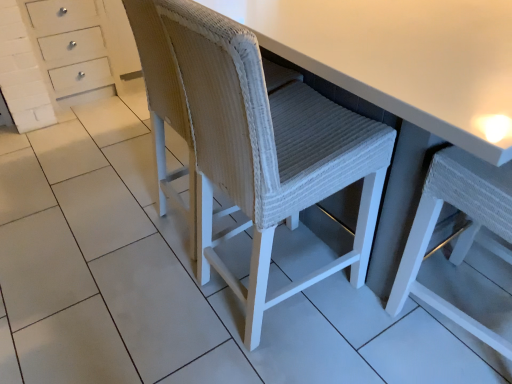
Measure the distance between point (x=506, y=207) and camera.

The depth of point (x=506, y=207) is 37.40 inches.

The image size is (512, 384). Identify the location of white woven chair at center, the 2th chair viewed from the right. (255, 140).

Where is `white woven chair at center, which ranks as the 1th chair in right-to-left order`? white woven chair at center, which ranks as the 1th chair in right-to-left order is located at coordinates (461, 233).

Does white woven stool at center appear on the right side of white woven swivel chair at center?

Correct, you'll find white woven stool at center to the right of white woven swivel chair at center.

Is white woven stool at center inside or outside of white woven swivel chair at center?

white woven stool at center is outside white woven swivel chair at center.

Which object is closer to the camera taking this photo, white woven chair at center, which is the 2th chair from left to right, or white woven chair at center, which appears as the first chair when viewed from the left?

white woven chair at center, which is the 2th chair from left to right, is closer to the camera.

Considering the sizes of white woven chair at center, which ranks as the 1th chair in right-to-left order, and white woven chair at center, which appears as the first chair when viewed from the left, in the image, is white woven chair at center, which ranks as the 1th chair in right-to-left order, wider or thinner than white woven chair at center, which appears as the first chair when viewed from the left,?

Clearly, white woven chair at center, which ranks as the 1th chair in right-to-left order, has less width compared to white woven chair at center, which appears as the first chair when viewed from the left.

From a real-world perspective, who is located lower, white woven chair at center, which is the 2th chair from left to right, or white woven chair at center, the 2th chair viewed from the right?

white woven chair at center, which is the 2th chair from left to right, is physically lower.

Is white woven chair at center, the 2th chair viewed from the right, not inside white woven chair at center, which ranks as the 1th chair in right-to-left order?

Yes, white woven chair at center, the 2th chair viewed from the right, is not within white woven chair at center, which ranks as the 1th chair in right-to-left order.

In the scene shown: In terms of width, does white woven chair at center, the 2th chair viewed from the right, look wider or thinner when compared to white woven chair at center, which ranks as the 1th chair in right-to-left order?

Considering their sizes, white woven chair at center, the 2th chair viewed from the right, looks broader than white woven chair at center, which ranks as the 1th chair in right-to-left order.

Can you tell me how much white woven chair at center, which appears as the first chair when viewed from the left, and white woven chair at center, which is the 2th chair from left to right, differ in facing direction?

The facing directions of white woven chair at center, which appears as the first chair when viewed from the left, and white woven chair at center, which is the 2th chair from left to right, are 92.7 degrees apart.

What's the angular difference between white woven stool at center and white woven chair at center, which ranks as the 1th chair in right-to-left order,'s facing directions?

The facing directions of white woven stool at center and white woven chair at center, which ranks as the 1th chair in right-to-left order, are 177 degrees apart.

Who is more distant, white woven stool at center or white woven chair at center, which ranks as the 1th chair in right-to-left order?

white woven stool at center is behind.

At what (x,y) coordinates should I click in order to perform the action: click on table located underneath the white woven chair at center, which ranks as the 1th chair in right-to-left order (from a real-world perspective). Please return your answer as a coordinate pair (x, y). Image resolution: width=512 pixels, height=384 pixels. Looking at the image, I should click on (405, 83).

Considering the sizes of white woven stool at center and white woven chair at center, which is the 2th chair from left to right, in the image, is white woven stool at center taller or shorter than white woven chair at center, which is the 2th chair from left to right,?

Clearly, white woven stool at center is shorter compared to white woven chair at center, which is the 2th chair from left to right.

Image resolution: width=512 pixels, height=384 pixels. In order to click on chair that is the 1st object to the right of the white woven swivel chair at center, starting at the anchor in this screenshot , I will do `click(255, 140)`.

Is white woven chair at center, which appears as the first chair when viewed from the left, thinner than white woven swivel chair at center?

Incorrect, the width of white woven chair at center, which appears as the first chair when viewed from the left, is not less than that of white woven swivel chair at center.

Does white woven chair at center, which appears as the first chair when viewed from the left, touch white woven swivel chair at center?

No.

Considering the relative sizes of white woven chair at center, which ranks as the 1th chair in right-to-left order, and white woven stool at center in the image provided, is white woven chair at center, which ranks as the 1th chair in right-to-left order, smaller than white woven stool at center?

Yes.

Which object is closer to the camera, white woven chair at center, which is the 2th chair from left to right, or white woven stool at center?

white woven chair at center, which is the 2th chair from left to right, is more forward.

Can you confirm if white woven chair at center, which is the 2th chair from left to right, is thinner than white woven stool at center?

Yes, white woven chair at center, which is the 2th chair from left to right, is thinner than white woven stool at center.

Can you tell me how much white woven chair at center, which is the 2th chair from left to right, and white woven stool at center differ in facing direction?

The angular difference between white woven chair at center, which is the 2th chair from left to right, and white woven stool at center is 177 degrees.

This screenshot has width=512, height=384. Find the location of `table to the right of white woven chair at center, the 2th chair viewed from the right`. table to the right of white woven chair at center, the 2th chair viewed from the right is located at coordinates (405, 83).

What's the angular difference between white woven chair at center, the 2th chair viewed from the right, and white woven stool at center's facing directions?

There is a 89.9-degree angle between the facing directions of white woven chair at center, the 2th chair viewed from the right, and white woven stool at center.

Is white woven chair at center, the 2th chair viewed from the right, not within white woven stool at center?

Result: No, white woven chair at center, the 2th chair viewed from the right, is inside or overlapping with white woven stool at center.

From a real-world perspective, is white woven chair at center, which appears as the first chair when viewed from the left, positioned above or below white woven stool at center?

Clearly, from a real-world perspective, white woven chair at center, which appears as the first chair when viewed from the left, is above white woven stool at center.

I want to click on swivel chair located above the white woven stool at center (from a real-world perspective), so click(163, 102).

Locate an element on the screen. This screenshot has width=512, height=384. chair behind the white woven chair at center, which ranks as the 1th chair in right-to-left order is located at coordinates coord(255,140).

Looking at the image, which one is located further to white woven chair at center, the 2th chair viewed from the right, white woven swivel chair at center or white woven stool at center?

white woven stool at center is further to white woven chair at center, the 2th chair viewed from the right.

Based on the photo, which object lies further to the anchor point white woven chair at center, which ranks as the 1th chair in right-to-left order, white woven swivel chair at center or white woven chair at center, the 2th chair viewed from the right?

white woven swivel chair at center.

Based on their spatial positions, is white woven swivel chair at center or white woven chair at center, which is the 2th chair from left to right, closer to white woven stool at center?

white woven chair at center, which is the 2th chair from left to right, lies closer to white woven stool at center than the other object.

Based on their spatial positions, is white woven swivel chair at center or white woven chair at center, which ranks as the 1th chair in right-to-left order, further from white woven chair at center, which appears as the first chair when viewed from the left?

The object further to white woven chair at center, which appears as the first chair when viewed from the left, is white woven chair at center, which ranks as the 1th chair in right-to-left order.

Which object lies nearer to the anchor point white woven swivel chair at center, white woven stool at center or white woven chair at center, which ranks as the 1th chair in right-to-left order?

Based on the image, white woven stool at center appears to be nearer to white woven swivel chair at center.

Considering their positions, is white woven chair at center, the 2th chair viewed from the right, positioned further to white woven stool at center than white woven swivel chair at center?

white woven swivel chair at center.

Which object lies further to the anchor point white woven chair at center, the 2th chair viewed from the right, white woven stool at center or white woven chair at center, which ranks as the 1th chair in right-to-left order?

white woven chair at center, which ranks as the 1th chair in right-to-left order, is further to white woven chair at center, the 2th chair viewed from the right.

When comparing their distances from white woven chair at center, which ranks as the 1th chair in right-to-left order, does white woven chair at center, the 2th chair viewed from the right, or white woven stool at center seem closer?

Based on the image, white woven stool at center appears to be nearer to white woven chair at center, which ranks as the 1th chair in right-to-left order.

The image size is (512, 384). What are the coordinates of `chair located between white woven chair at center, which appears as the first chair when viewed from the left, and white woven stool at center in the left-right direction` in the screenshot? It's located at (461, 233).

Where is `chair situated between white woven swivel chair at center and white woven chair at center, which is the 2th chair from left to right, from left to right`? chair situated between white woven swivel chair at center and white woven chair at center, which is the 2th chair from left to right, from left to right is located at coordinates (255, 140).